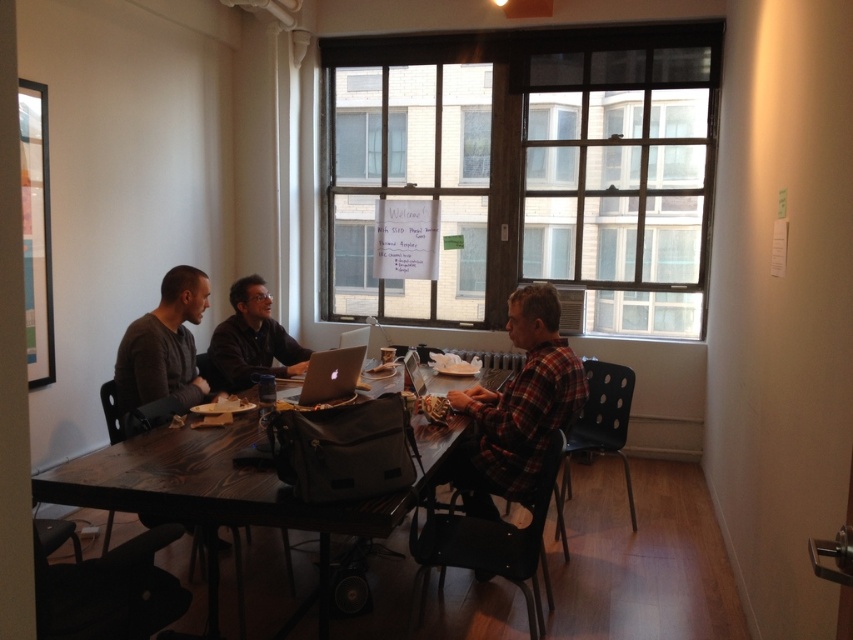
From the picture: You are a delivery person who needs to place a package between the dark gray sweater at left and the whiteboard at upper center. The package requires 2 meters of space. Can you fit it there?

The distance between the dark gray sweater at left and the whiteboard at upper center is 2.38 meters, which is more than enough to fit a package requiring 2 meters of space.

You are a person sitting at the table in the room. You want to reach the clear glass window at upper center to open it. The dark gray sweater at center is blocking your path. Can you step over it?

The dark gray sweater at center is 6.70 feet away from the clear glass window at upper center. Since the sweater is only blocking your path if it is directly in between you and the window, but it is 6.70 feet away, you can easily walk around it to reach the window.

In the scene shown: You are a guest entering the room and want to place your dark gray sweater at center on the table without blocking the view of the clear glass window at upper center. Is this possible?

The dark gray sweater at center is below the clear glass window at upper center, so placing it on the table won not block the view of the clear glass window at upper center since they are at different vertical positions.